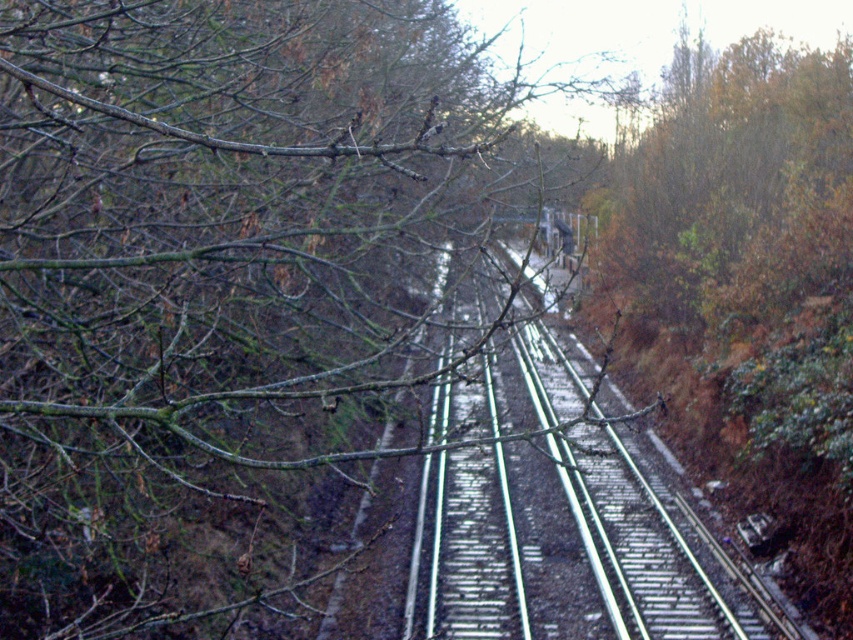
You are standing at the starting point of the railway track and want to walk towards the distant point. Which of the two points, point(318,260) or point(660,582), will you encounter first along your path?

You will encounter point(318,260) first because it is closer to the camera than point(660,582), meaning it is nearer to your starting position.

You are standing at the point marked by the coordinates point [213,285] in the image. What is the nearest object to you in the scene?

The nearest object to the point [213,285] is the green matte branches at upper left, as the point represents its location.

You are a railway inspector checking the tracks. You notice the green matte branches at upper left. Where exactly are they located in the image?

The green matte branches at upper left are located at point (213, 285).